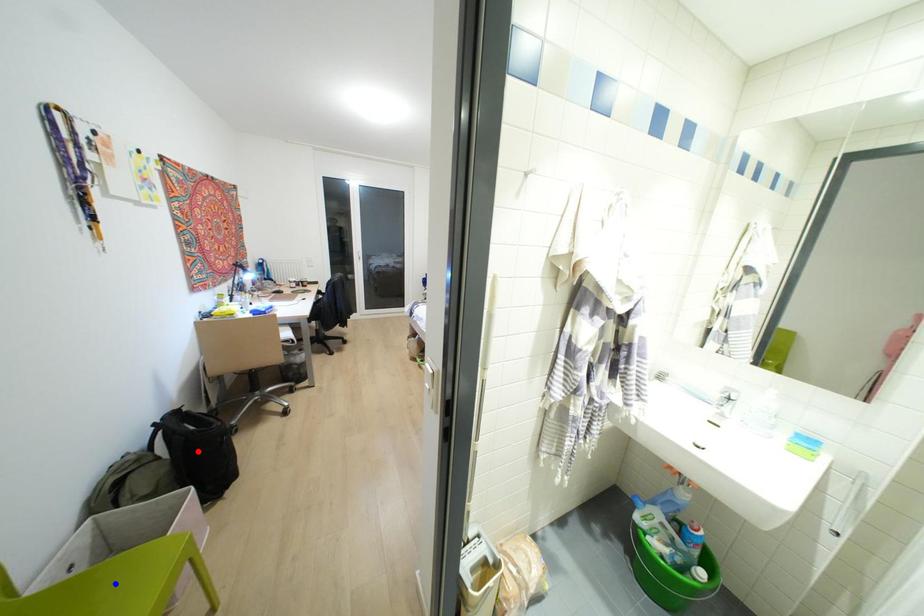
Question: In the image, two points are highlighted. Which point is nearer to the camera? Reply with the corresponding letter.

Choices:
 (A) blue point
 (B) red point

Answer: (A)